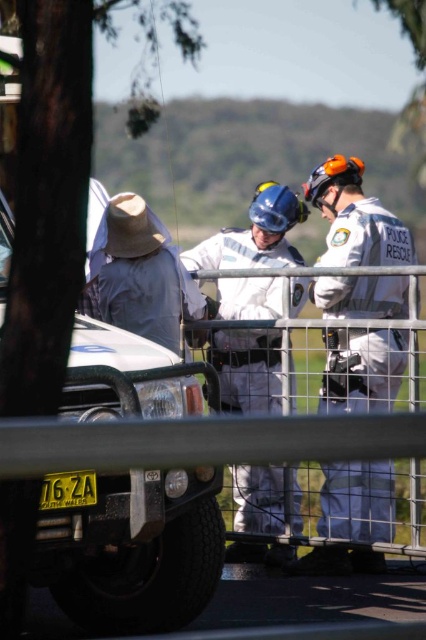
You are a delivery drone with a 1.8 meter wingspan. You need to fly from the matte white vehicle at left to the white matte uniform at center. Can you safely pass through the space between them without touching either?

The distance between the matte white vehicle at left and the white matte uniform at center is 2.59 meters. Since your drone has a wingspan of 1.8 meters, there is enough space for you to safely pass through the gap without touching either object.

You are a photographer trying to capture a wide shot of the scene. The matte white vehicle at left and the white matte uniform at center are both in your frame. Given their sizes, which object would appear larger in your photo?

The matte white vehicle at left would appear larger in the photo since its width is larger than the white matte uniform at center.

What are the coordinates of the matte white vehicle at left in the image?

The coordinates of the matte white vehicle at left are at point (129, 547).